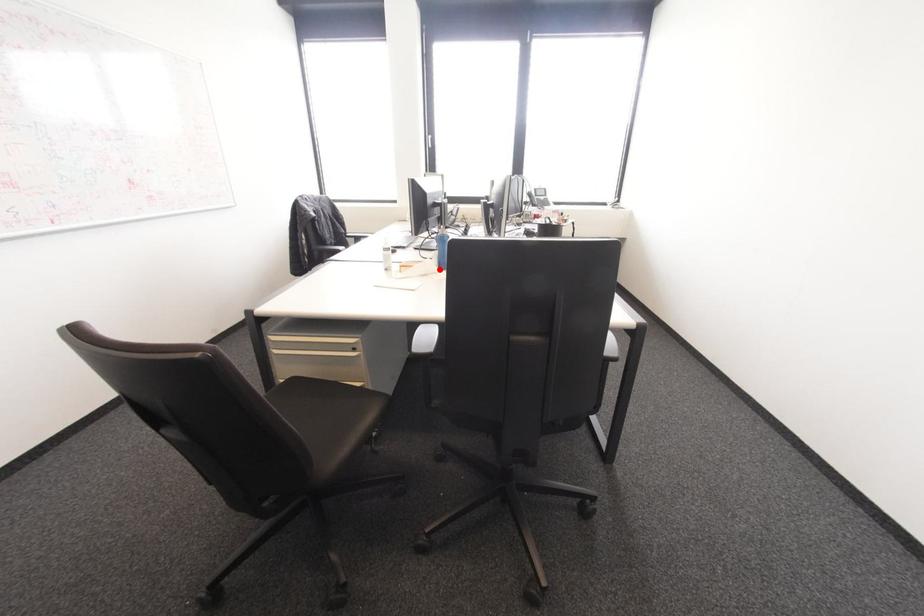
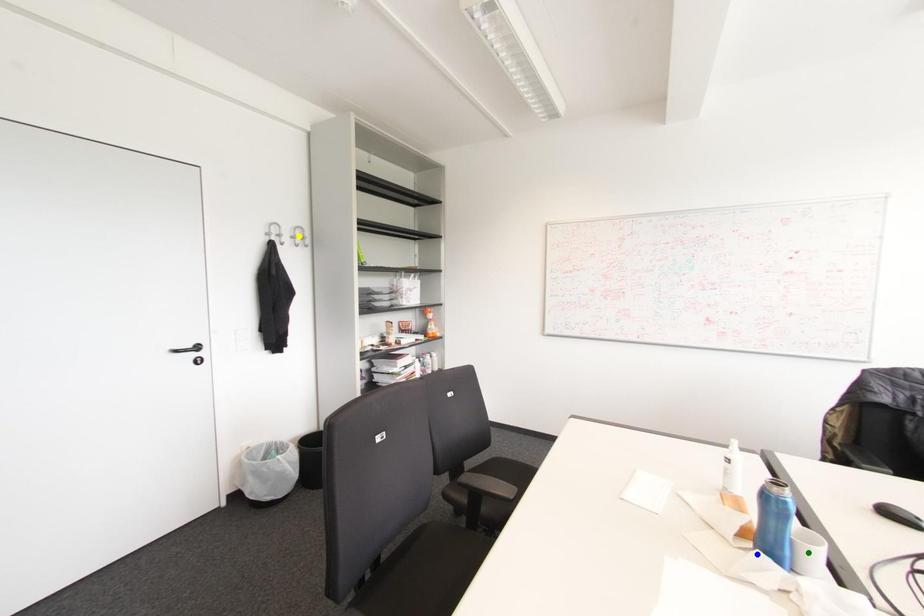
Question: I am providing you with two images of the same scene from different viewpoints. A red point is marked on the first image. You are given multiple points on the second image. Can you choose the point in image 2 that corresponds to the point in image 1?

Choices:
 (A) blue point
 (B) yellow point
 (C) green point

Answer: (A)